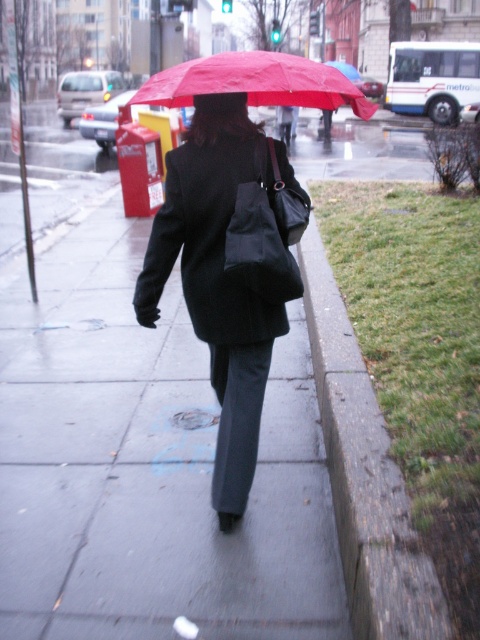
Looking at this image, can you confirm if matte black coat at center is bigger than red matte umbrella at upper center?

No, matte black coat at center is not bigger than red matte umbrella at upper center.

Identify the location of matte black coat at center. (x=216, y=280).

Is point (292, 188) positioned in front of point (190, 84)?

No, (292, 188) is behind (190, 84).

The width and height of the screenshot is (480, 640). In order to click on matte black coat at center in this screenshot , I will do `click(216, 280)`.

Is matte black coat at center to the left of concrete at lower right from the viewer's perspective?

Indeed, matte black coat at center is positioned on the left side of concrete at lower right.

Is matte black coat at center above concrete at lower right?

Correct, matte black coat at center is located above concrete at lower right.

What are the coordinates of `matte black coat at center` in the screenshot? It's located at (216, 280).

At what (x,y) coordinates should I click in order to perform the action: click on matte black coat at center. Please return your answer as a coordinate pair (x, y). The image size is (480, 640). Looking at the image, I should click on (216, 280).

This screenshot has width=480, height=640. What do you see at coordinates (148, 465) in the screenshot?
I see `gray concrete sidewalk at center` at bounding box center [148, 465].

Is point (73, 472) closer to camera compared to point (405, 513)?

No.

Describe the element at coordinates (148, 465) in the screenshot. I see `gray concrete sidewalk at center` at that location.

Locate an element on the screen. The height and width of the screenshot is (640, 480). gray concrete sidewalk at center is located at coordinates (148, 465).